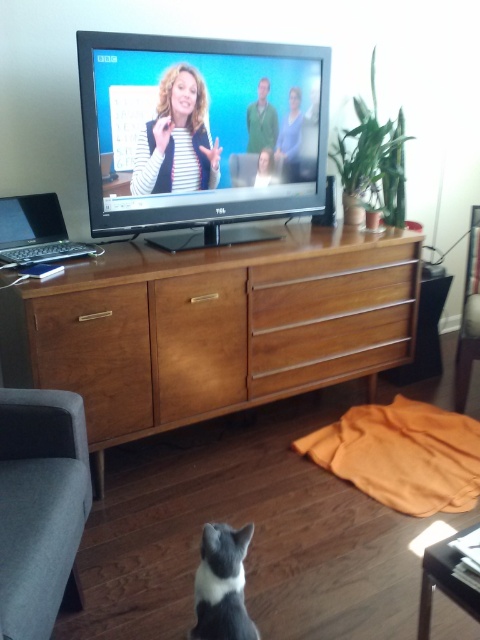
Between brown wood entertainment center at center and silver metallic laptop at left, which one is positioned lower?

brown wood entertainment center at center is below.

Can you confirm if brown wood entertainment center at center is positioned above silver metallic laptop at left?

No.

Does point (217, 250) come in front of point (84, 250)?

No, it is behind (84, 250).

Locate an element on the screen. Image resolution: width=480 pixels, height=640 pixels. brown wood entertainment center at center is located at coordinates (212, 326).

Can you confirm if brown wood entertainment center at center is positioned to the right of gray fabric armchair at lower left?

Yes, brown wood entertainment center at center is to the right of gray fabric armchair at lower left.

Which is above, brown wood entertainment center at center or gray fabric armchair at lower left?

brown wood entertainment center at center is above.

Where is `brown wood entertainment center at center`? The height and width of the screenshot is (640, 480). brown wood entertainment center at center is located at coordinates (212, 326).

Is wooden drawer at center bigger than black and white fur cat at lower center?

Yes, wooden drawer at center is bigger than black and white fur cat at lower center.

Does wooden drawer at center have a lesser width compared to black and white fur cat at lower center?

In fact, wooden drawer at center might be wider than black and white fur cat at lower center.

Which is in front, point (410, 273) or point (227, 573)?

Point (227, 573) is in front.

Locate an element on the screen. This screenshot has height=640, width=480. wooden drawer at center is located at coordinates (328, 316).